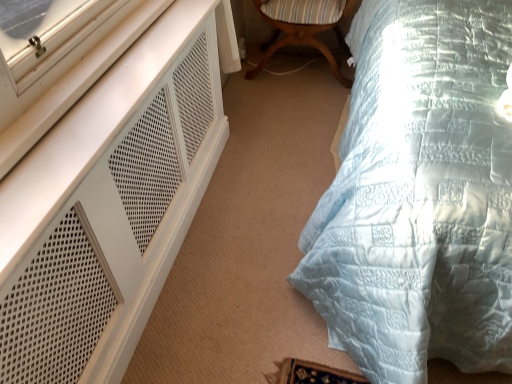
What do you see at coordinates (420, 197) in the screenshot? I see `light blue quilted bed at right` at bounding box center [420, 197].

You are a GUI agent. You are given a task and a screenshot of the screen. Output one action in this format:
    pyautogui.click(x=<x>, y=<y>)
    Task: Click on the wooden striped cushion at center
    
    Given the screenshot: What is the action you would take?
    pyautogui.click(x=304, y=28)

What do you see at coordinates (304, 28) in the screenshot? I see `wooden striped cushion at center` at bounding box center [304, 28].

This screenshot has height=384, width=512. Describe the element at coordinates (109, 205) in the screenshot. I see `white mesh dresser at left` at that location.

Find the location of a particular element. Image resolution: width=512 pixels, height=384 pixels. white mesh dresser at left is located at coordinates (109, 205).

Find the location of a particular element. light blue quilted bed at right is located at coordinates (420, 197).

Is white mesh dresser at left next to light blue quilted bed at right and touching it?

No.

Is white mesh dresser at left facing away from light blue quilted bed at right?

No, light blue quilted bed at right is not at the back of white mesh dresser at left.

Looking at the image, does white mesh dresser at left seem bigger or smaller compared to light blue quilted bed at right?

white mesh dresser at left is smaller than light blue quilted bed at right.

From the picture: Considering the sizes of white mesh dresser at left and light blue quilted bed at right in the image, is white mesh dresser at left taller or shorter than light blue quilted bed at right?

Clearly, white mesh dresser at left is shorter compared to light blue quilted bed at right.

Which of these two, light blue quilted bed at right or white mesh dresser at left, is smaller?

With smaller size is white mesh dresser at left.

From a real-world perspective, is light blue quilted bed at right physically located above or below white mesh dresser at left?

Clearly, from a real-world perspective, light blue quilted bed at right is above white mesh dresser at left.

Looking at this image, is light blue quilted bed at right turned away from white mesh dresser at left?

light blue quilted bed at right does not have its back to white mesh dresser at left.

You are a GUI agent. You are given a task and a screenshot of the screen. Output one action in this format:
    pyautogui.click(x=<x>, y=<y>)
    Task: Click on the dresser below the light blue quilted bed at right (from a real-world perspective)
    
    Given the screenshot: What is the action you would take?
    click(109, 205)

From a real-world perspective, between wooden striped cushion at center and white mesh dresser at left, who is vertically higher?

From a 3D spatial view, white mesh dresser at left is above.

Is wooden striped cushion at center looking in the opposite direction of white mesh dresser at left?

No.

Does wooden striped cushion at center have a lesser width compared to white mesh dresser at left?

In fact, wooden striped cushion at center might be wider than white mesh dresser at left.

Measure the distance between wooden striped cushion at center and light blue quilted bed at right.

wooden striped cushion at center is 3.69 feet from light blue quilted bed at right.

Is wooden striped cushion at center in contact with light blue quilted bed at right?

wooden striped cushion at center is not next to light blue quilted bed at right, and they're not touching.

Which is more to the left, wooden striped cushion at center or light blue quilted bed at right?

wooden striped cushion at center is more to the left.

Between wooden striped cushion at center and light blue quilted bed at right, which one is positioned in front?

Positioned in front is light blue quilted bed at right.

Between white mesh dresser at left and wooden striped cushion at center, which one is positioned behind?

wooden striped cushion at center is behind.

Is point (189, 88) more distant than point (325, 20)?

No, it is not.

Looking at the image, does white mesh dresser at left seem bigger or smaller compared to wooden striped cushion at center?

In the image, white mesh dresser at left appears to be larger than wooden striped cushion at center.

Does white mesh dresser at left have a greater height compared to wooden striped cushion at center?

Yes.

Are light blue quilted bed at right and wooden striped cushion at center located far from each other?

Yes, light blue quilted bed at right and wooden striped cushion at center are quite far apart.

Is light blue quilted bed at right looking in the opposite direction of wooden striped cushion at center?

light blue quilted bed at right does not have its back to wooden striped cushion at center.

Is light blue quilted bed at right bigger than wooden striped cushion at center?

Result: Correct, light blue quilted bed at right is larger in size than wooden striped cushion at center.

Locate an element on the screen. bed located above the white mesh dresser at left (from a real-world perspective) is located at coordinates (420, 197).

What are the coordinates of `dresser on the left side of light blue quilted bed at right` in the screenshot? It's located at (109, 205).

Estimate the real-world distances between objects in this image. Which object is further from wooden striped cushion at center, white mesh dresser at left or light blue quilted bed at right?

white mesh dresser at left is positioned further to the anchor wooden striped cushion at center.

When comparing their distances from light blue quilted bed at right, does wooden striped cushion at center or white mesh dresser at left seem further?

wooden striped cushion at center.

When comparing their distances from white mesh dresser at left, does wooden striped cushion at center or light blue quilted bed at right seem closer?

light blue quilted bed at right is positioned closer to the anchor white mesh dresser at left.

Which object lies nearer to the anchor point white mesh dresser at left, light blue quilted bed at right or wooden striped cushion at center?

The object closer to white mesh dresser at left is light blue quilted bed at right.

When comparing their distances from wooden striped cushion at center, does light blue quilted bed at right or white mesh dresser at left seem further?

white mesh dresser at left lies further to wooden striped cushion at center than the other object.

Estimate the real-world distances between objects in this image. Which object is closer to light blue quilted bed at right, white mesh dresser at left or wooden striped cushion at center?

white mesh dresser at left.

Find the location of a particular element. This screenshot has height=384, width=512. dresser between light blue quilted bed at right and wooden striped cushion at center from front to back is located at coordinates (109, 205).